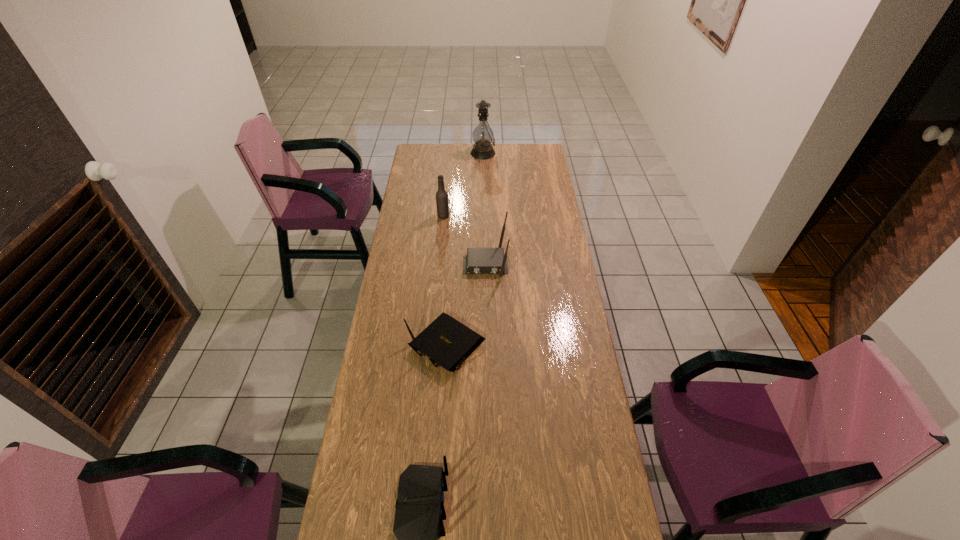
In order to click on free spot located 0.180m on the right of the second nearest router in this screenshot , I will do `click(535, 345)`.

Identify the location of object located in the far edge section of the desktop. (483, 136).

Where is `object that is at the left edge`? This screenshot has width=960, height=540. object that is at the left edge is located at coordinates [x=447, y=342].

At what (x,y) coordinates should I click in order to perform the action: click on vacant region at the far edge of the desktop. Please return your answer as a coordinate pair (x, y). Looking at the image, I should click on (452, 145).

The width and height of the screenshot is (960, 540). In the image, there is a desktop. Identify the location of vacant space at the left edge. (347, 491).

Where is `vacant space at the right edge of the desktop`? Image resolution: width=960 pixels, height=540 pixels. vacant space at the right edge of the desktop is located at coordinates (608, 460).

Where is `free space at the far left corner`? free space at the far left corner is located at coordinates (440, 156).

Locate an element on the screen. free space at the far right corner of the desktop is located at coordinates (524, 143).

Where is `empty location between the oil lamp and the beer bottle`? empty location between the oil lamp and the beer bottle is located at coordinates (463, 185).

Find the location of `blank region between the fourth nearest object and the farthest object`. blank region between the fourth nearest object and the farthest object is located at coordinates (463, 185).